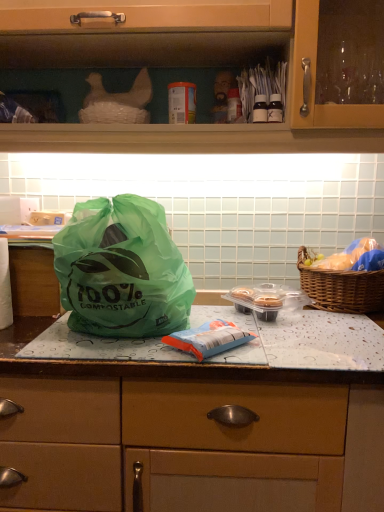
Find the location of a particular element. This screenshot has width=384, height=512. matte wood cabinet at upper center is located at coordinates (183, 65).

This screenshot has height=512, width=384. I want to click on translucent plastic bag at right, positioned as the 1th food in right-to-left order, so click(353, 257).

You are a GUI agent. You are given a task and a screenshot of the screen. Output one action in this format:
    pyautogui.click(x=<x>, y=<y>)
    Task: Click on the blue matte plastic bag at center, the 1th food positioned from the bottom
    This screenshot has height=512, width=384.
    Given the screenshot: What is the action you would take?
    click(209, 339)

What are the coordinates of `green plastic bag at center` in the screenshot? It's located at (187, 435).

This screenshot has width=384, height=512. What are the coordinates of `counter top below the blue matte plastic bag at center, the 1th food positioned from the bottom (from the image's perspective)` in the screenshot? It's located at (304, 340).

Can you confirm if blue matte plastic bag at center, the 1th food positioned from the bottom, is taller than green plastic bag at center?

Correct, blue matte plastic bag at center, the 1th food positioned from the bottom, is much taller as green plastic bag at center.

From the picture: Would you say blue matte plastic bag at center, acting as the second food starting from the back, is inside or outside green plastic bag at center?

The correct answer is: outside.

Which is more to the left, blue matte plastic bag at center, arranged as the 2th food when viewed from the top, or green plastic bag at center?

Positioned to the left is green plastic bag at center.

Is green plastic bag at center not close to white paper towel at left?

green plastic bag at center is actually quite close to white paper towel at left.

Is point (364, 318) closer to camera compared to point (7, 321)?

No.

Is green plastic bag at center turned away from white paper towel at left?

No, green plastic bag at center is not facing the opposite direction of white paper towel at left.

Would you say green plastic bag at center is to the left or to the right of white paper towel at left in the picture?

Based on their positions, green plastic bag at center is located to the right of white paper towel at left.

From the image's perspective, is blue matte plastic bag at center, acting as the second food starting from the back, beneath green plastic bag at center?

No, from the image's perspective, blue matte plastic bag at center, acting as the second food starting from the back, is not beneath green plastic bag at center.

Can we say blue matte plastic bag at center, acting as the second food starting from the back, lies outside green plastic bag at center?

Yes, blue matte plastic bag at center, acting as the second food starting from the back, is outside of green plastic bag at center.

Which is behind, point (200, 360) or point (340, 384)?

The point (340, 384) is farther from the camera.

Which object is more forward, blue matte plastic bag at center, the 1th food positioned from the bottom, or green plastic bag at center?

green plastic bag at center is more forward.

Consider the image. Considering the relative positions of translucent plastic bag at right, the 1th food viewed from the top, and blue matte plastic bag at center, arranged as the 2th food when viewed from the top, in the image provided, is translucent plastic bag at right, the 1th food viewed from the top, in front of blue matte plastic bag at center, arranged as the 2th food when viewed from the top,?

No, translucent plastic bag at right, the 1th food viewed from the top, is further to the viewer.

From the image's perspective, who appears lower, translucent plastic bag at right, positioned as the 1th food in right-to-left order, or blue matte plastic bag at center, acting as the second food starting from the back?

blue matte plastic bag at center, acting as the second food starting from the back, is shown below in the image.

Is translucent plastic bag at right, acting as the second food starting from the bottom, at the right side of blue matte plastic bag at center, which is counted as the 1th food, starting from the front?

Yes, translucent plastic bag at right, acting as the second food starting from the bottom, is to the right of blue matte plastic bag at center, which is counted as the 1th food, starting from the front.

Is translucent plastic bag at right, which is counted as the second food, starting from the left, far away from blue matte plastic bag at center, which ranks as the 1th food in left-to-right order?

That's not correct — translucent plastic bag at right, which is counted as the second food, starting from the left, is a little close to blue matte plastic bag at center, which ranks as the 1th food in left-to-right order.

Considering the sizes of objects green plastic bag at center and matte wood cabinet at upper center in the image provided, who is wider, green plastic bag at center or matte wood cabinet at upper center?

Wider between the two is matte wood cabinet at upper center.

Is green plastic bag at center facing away from matte wood cabinet at upper center?

No, matte wood cabinet at upper center is not at the back of green plastic bag at center.

From a real-world perspective, which object rests below the other?

green plastic bag at center is physically lower.

Can matte wood cabinet at upper center be found inside green plastic bag at center?

Definitely not — matte wood cabinet at upper center is not inside green plastic bag at center.

How different are the orientations of brown woven picnic basket at right and blue matte plastic bag at center, which is counted as the 1th food, starting from the front, in degrees?

40.7 degrees separate the facing orientations of brown woven picnic basket at right and blue matte plastic bag at center, which is counted as the 1th food, starting from the front.

Is brown woven picnic basket at right not within blue matte plastic bag at center, acting as the second food starting from the back?

Yes.

Relative to blue matte plastic bag at center, which is counted as the 1th food, starting from the front, is brown woven picnic basket at right in front or behind?

Clearly, brown woven picnic basket at right is behind blue matte plastic bag at center, which is counted as the 1th food, starting from the front.

Based on the photo, considering the sizes of brown woven picnic basket at right and blue matte plastic bag at center, arranged as the 2th food when viewed from the top, in the image, is brown woven picnic basket at right wider or thinner than blue matte plastic bag at center, arranged as the 2th food when viewed from the top,?

Considering their sizes, brown woven picnic basket at right looks broader than blue matte plastic bag at center, arranged as the 2th food when viewed from the top.

Find the location of a particular element. plastic bag located in front of the green plastic bag at center is located at coordinates (122, 270).

Is green plastic bag at center positioned beyond the bounds of green plastic bag at center?

Absolutely, green plastic bag at center is external to green plastic bag at center.

Considering the relative sizes of green plastic bag at center and green plastic bag at center in the image provided, is green plastic bag at center smaller than green plastic bag at center?

Yes.

Does green plastic bag at center come in front of green plastic bag at center?

No, green plastic bag at center is further to the viewer.

From a real-world perspective, count 1st foods upward from the green plastic bag at center and point to it. Please provide its 2D coordinates.

[(209, 339)]

Identify the location of toilet paper behind the green plastic bag at center. (5, 286).

Looking at the image, which one is located closer to white paper towel at left, translucent plastic bag at right, the first food viewed from the back, or blue matte plastic bag at center, the 1th food positioned from the bottom?

The object closer to white paper towel at left is blue matte plastic bag at center, the 1th food positioned from the bottom.

In the scene shown: When comparing their distances from green plastic bag at center, does translucent plastic bag at right, acting as the second food starting from the bottom, or green plastic bag at center seem closer?

green plastic bag at center lies closer to green plastic bag at center than the other object.

Based on their spatial positions, is white paper towel at left or matte wood cabinet at upper center further from green plastic bag at center?

matte wood cabinet at upper center is positioned further to the anchor green plastic bag at center.

Based on their spatial positions, is green plastic bag at center or green plastic bag at center closer to matte wood cabinet at upper center?

Among the two, green plastic bag at center is located nearer to matte wood cabinet at upper center.

Estimate the real-world distances between objects in this image. Which object is further from matte wood cabinet at upper center, green plastic bag at center or green plastic bag at center?

green plastic bag at center is further to matte wood cabinet at upper center.

Estimate the real-world distances between objects in this image. Which object is further from green plastic bag at center, green plastic bag at center or matte wood cabinet at upper center?

Based on the image, matte wood cabinet at upper center appears to be further to green plastic bag at center.

Which object lies further to the anchor point white paper towel at left, matte wood cabinet at upper center or blue matte plastic bag at center, which ranks as the 1th food in left-to-right order?

The object further to white paper towel at left is matte wood cabinet at upper center.

From the image, which object appears to be farther from green plastic bag at center, white paper towel at left or matte wood cabinet at upper center?

matte wood cabinet at upper center lies further to green plastic bag at center than the other object.

Where is `counter top that lies between translucent plastic bag at right, the first food viewed from the back, and green plastic bag at center from top to bottom`? counter top that lies between translucent plastic bag at right, the first food viewed from the back, and green plastic bag at center from top to bottom is located at coordinates (304, 340).

You are a GUI agent. You are given a task and a screenshot of the screen. Output one action in this format:
    pyautogui.click(x=<x>, y=<y>)
    Task: Click on the counter top between white paper towel at left and green plastic bag at center vertically
    Image resolution: width=384 pixels, height=512 pixels.
    Given the screenshot: What is the action you would take?
    pyautogui.click(x=304, y=340)

This screenshot has height=512, width=384. In order to click on cabinetry between green plastic bag at center and brown woven picnic basket at right in the horizontal direction in this screenshot , I will do `click(183, 65)`.

The image size is (384, 512). I want to click on food between matte wood cabinet at upper center and blue matte plastic bag at center, arranged as the 2th food when viewed from the top, from top to bottom, so click(x=353, y=257).